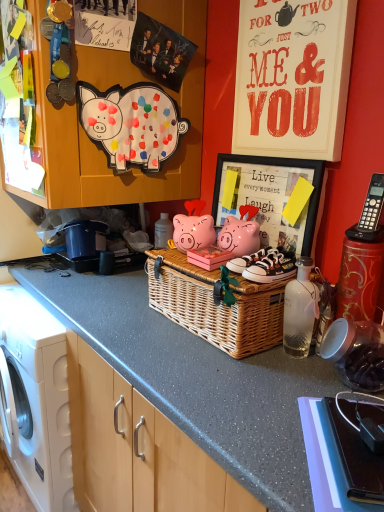
Question: Is black plastic phone at upper right aimed at white canvas sneakers at center, arranged as the second footwear when viewed from the back?

Choices:
 (A) no
 (B) yes

Answer: (A)

Question: Considering the relative sizes of black plastic phone at upper right and white canvas sneakers at center, arranged as the first footwear when viewed from the front, in the image provided, is black plastic phone at upper right smaller than white canvas sneakers at center, arranged as the first footwear when viewed from the front,?

Choices:
 (A) yes
 (B) no

Answer: (B)

Question: Considering the relative positions of black plastic phone at upper right and white canvas sneakers at center, arranged as the second footwear when viewed from the back, in the image provided, is black plastic phone at upper right to the right of white canvas sneakers at center, arranged as the second footwear when viewed from the back, from the viewer's perspective?

Choices:
 (A) no
 (B) yes

Answer: (B)

Question: Is black plastic phone at upper right taller than white canvas sneakers at center, arranged as the first footwear when viewed from the front?

Choices:
 (A) yes
 (B) no

Answer: (B)

Question: Considering the relative sizes of black plastic phone at upper right and white canvas sneakers at center, arranged as the first footwear when viewed from the front, in the image provided, is black plastic phone at upper right bigger than white canvas sneakers at center, arranged as the first footwear when viewed from the front,?

Choices:
 (A) no
 (B) yes

Answer: (B)

Question: Looking at the image, does woven wicker basket at center seem bigger or smaller compared to white matte washing machine at left?

Choices:
 (A) small
 (B) big

Answer: (A)

Question: From the image's perspective, is woven wicker basket at center above or below white matte washing machine at left?

Choices:
 (A) below
 (B) above

Answer: (B)

Question: From a real-world perspective, is woven wicker basket at center physically located above or below white matte washing machine at left?

Choices:
 (A) below
 (B) above

Answer: (B)

Question: Does point (147, 284) appear closer or farther from the camera than point (59, 459)?

Choices:
 (A) farther
 (B) closer

Answer: (B)

Question: Is white paper at upper right in front of or behind matte paper pig at upper left, which is the first pig in top-to-bottom order, in the image?

Choices:
 (A) front
 (B) behind

Answer: (A)

Question: Looking at the image, does white paper at upper right seem bigger or smaller compared to matte paper pig at upper left, the 2th pig positioned from the bottom?

Choices:
 (A) small
 (B) big

Answer: (B)

Question: In terms of height, does white paper at upper right look taller or shorter compared to matte paper pig at upper left, which is the first pig in top-to-bottom order?

Choices:
 (A) short
 (B) tall

Answer: (B)

Question: Is point (289, 47) positioned closer to the camera than point (135, 150)?

Choices:
 (A) farther
 (B) closer

Answer: (B)

Question: From a real-world perspective, is white canvas sneakers at center, which is counted as the 2th footwear, starting from the front, above or below white paper at upper right?

Choices:
 (A) above
 (B) below

Answer: (B)

Question: Which is correct: white canvas sneakers at center, which is counted as the 2th footwear, starting from the front, is inside white paper at upper right, or outside of it?

Choices:
 (A) inside
 (B) outside

Answer: (B)